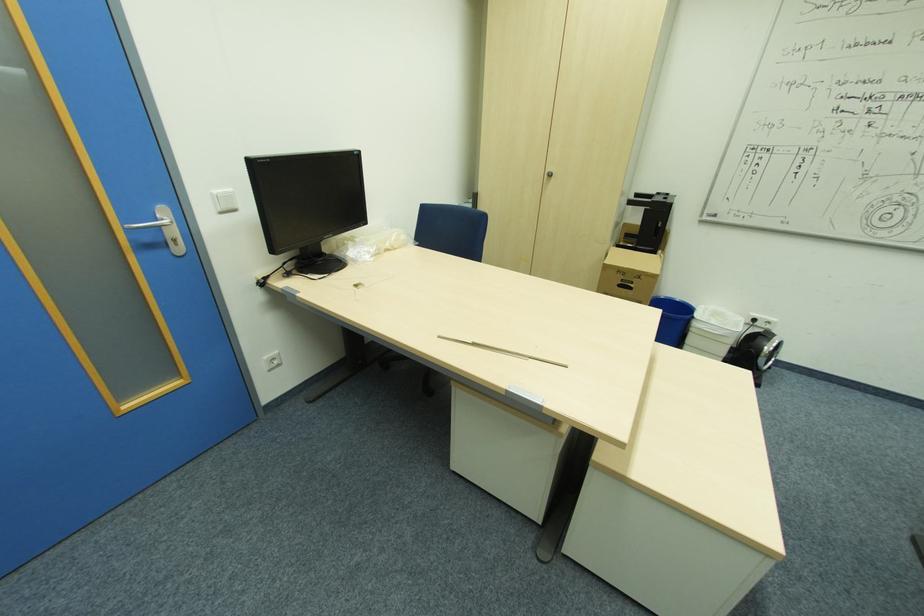
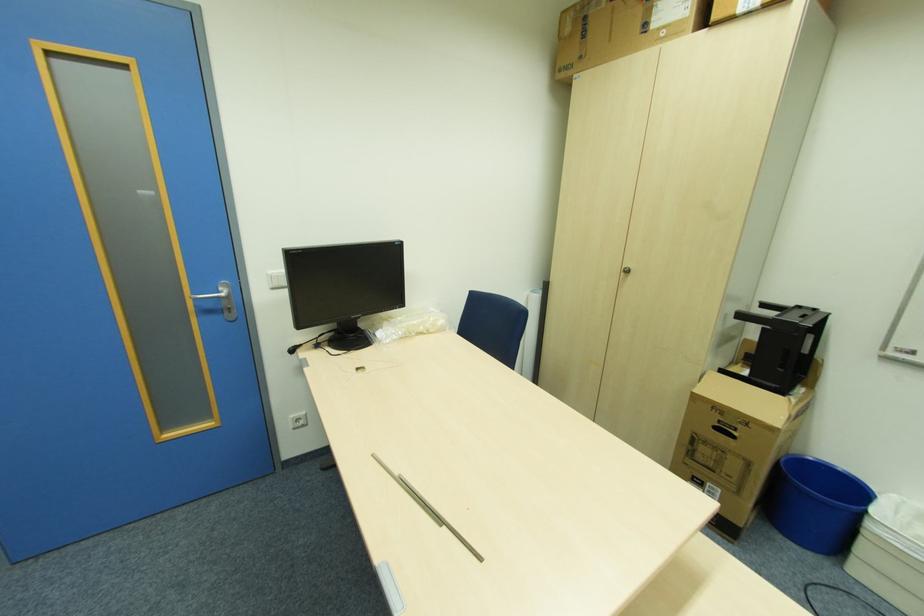
Question: The first image is from the beginning of the video and the second image is from the end. How did the camera likely rotate when shooting the video?

Choices:
 (A) Left
 (B) Right
 (C) Up
 (D) Down

Answer: (A)